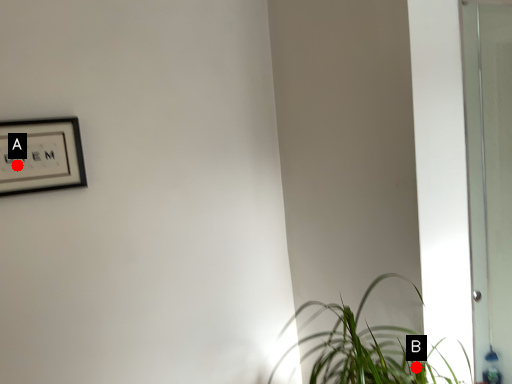
Question: Two points are circled on the image, labeled by A and B beside each circle. Which point is farther from the camera taking this photo?

Choices:
 (A) A is further
 (B) B is further

Answer: (A)